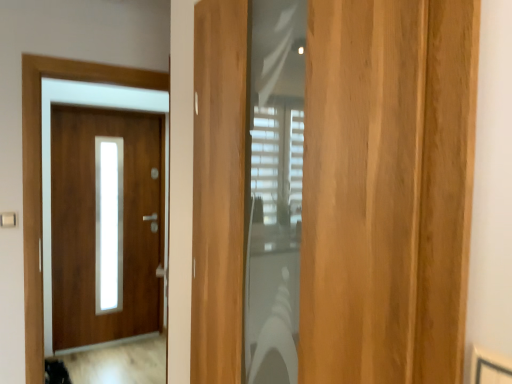
How much space does light brown wood door at center, which is the first door in front-to-back order, occupy vertically?

light brown wood door at center, which is the first door in front-to-back order, is 3.99 feet in height.

What do you see at coordinates (387, 189) in the screenshot? I see `light brown wood door at center, which ranks as the second door in left-to-right order` at bounding box center [387, 189].

Locate an element on the screen. This screenshot has width=512, height=384. light brown wood door at center, which ranks as the second door in left-to-right order is located at coordinates (387, 189).

In order to click on matte wood door at left, marked as the 1th door in a left-to-right arrangement in this screenshot , I will do `click(94, 223)`.

From the picture: What is the approximate width of matte wood door at left, marked as the 1th door in a left-to-right arrangement?

matte wood door at left, marked as the 1th door in a left-to-right arrangement, is 4.40 inches in width.

Describe the element at coordinates (94, 223) in the screenshot. This screenshot has height=384, width=512. I see `matte wood door at left, marked as the 1th door in a left-to-right arrangement` at that location.

Where is `light brown wood door at center, which is the first door in front-to-back order`? light brown wood door at center, which is the first door in front-to-back order is located at coordinates (387, 189).

Between matte wood door at left, acting as the second door starting from the front, and light brown wood door at center, the first door in the right-to-left sequence, which one appears on the right side from the viewer's perspective?

Positioned to the right is light brown wood door at center, the first door in the right-to-left sequence.

Is matte wood door at left, marked as the 1th door in a left-to-right arrangement, in front of light brown wood door at center, which is the first door in front-to-back order?

No.

Is point (148, 330) farther from camera compared to point (301, 250)?

Yes, point (148, 330) is farther from viewer.

From the image's perspective, which one is positioned lower, matte wood door at left, placed as the 1th door when sorted from back to front, or light brown wood door at center, which ranks as the second door in left-to-right order?

matte wood door at left, placed as the 1th door when sorted from back to front.

From a real-world perspective, who is located lower, matte wood door at left, acting as the second door starting from the front, or light brown wood door at center, which is the first door in front-to-back order?

From a 3D spatial view, matte wood door at left, acting as the second door starting from the front, is below.

Considering the relative sizes of matte wood door at left, marked as the 1th door in a left-to-right arrangement, and light brown wood door at center, which ranks as the second door in left-to-right order, in the image provided, is matte wood door at left, marked as the 1th door in a left-to-right arrangement, wider than light brown wood door at center, which ranks as the second door in left-to-right order,?

No, matte wood door at left, marked as the 1th door in a left-to-right arrangement, is not wider than light brown wood door at center, which ranks as the second door in left-to-right order.

Which of these two, matte wood door at left, marked as the 1th door in a left-to-right arrangement, or light brown wood door at center, the 2th door when ordered from back to front, stands shorter?

Standing shorter between the two is light brown wood door at center, the 2th door when ordered from back to front.

Can you confirm if matte wood door at left, acting as the second door starting from the front, is bigger than light brown wood door at center, the first door in the right-to-left sequence?

Yes.

Is matte wood door at left, placed as the 1th door when sorted from back to front, outside of light brown wood door at center, the 2th door when ordered from back to front?

Yes, matte wood door at left, placed as the 1th door when sorted from back to front, is located beyond the bounds of light brown wood door at center, the 2th door when ordered from back to front.

Would you consider matte wood door at left, acting as the second door starting from the front, to be distant from light brown wood door at center, the first door in the right-to-left sequence?

matte wood door at left, acting as the second door starting from the front, is far away from light brown wood door at center, the first door in the right-to-left sequence.

Is matte wood door at left, acting as the second door starting from the front, positioned with its back to light brown wood door at center, the 2th door when ordered from back to front?

No, light brown wood door at center, the 2th door when ordered from back to front, is not at the back of matte wood door at left, acting as the second door starting from the front.

What's the angular difference between matte wood door at left, acting as the second door starting from the front, and light brown wood door at center, the 2th door when ordered from back to front,'s facing directions?

The angle between the facing direction of matte wood door at left, acting as the second door starting from the front, and the facing direction of light brown wood door at center, the 2th door when ordered from back to front, is 90.5 degrees.

You are a GUI agent. You are given a task and a screenshot of the screen. Output one action in this format:
    pyautogui.click(x=<x>, y=<y>)
    Task: Click on the door that appears in front of the matte wood door at left, placed as the 1th door when sorted from back to front
    This screenshot has height=384, width=512.
    Given the screenshot: What is the action you would take?
    pyautogui.click(x=387, y=189)

Based on the photo, is light brown wood door at center, the 2th door when ordered from back to front, to the right of matte wood door at left, acting as the second door starting from the front, from the viewer's perspective?

Yes, light brown wood door at center, the 2th door when ordered from back to front, is to the right of matte wood door at left, acting as the second door starting from the front.

Considering the positions of objects light brown wood door at center, the 2th door when ordered from back to front, and matte wood door at left, which is the second door in right-to-left order, in the image provided, who is in front, light brown wood door at center, the 2th door when ordered from back to front, or matte wood door at left, which is the second door in right-to-left order,?

Positioned in front is light brown wood door at center, the 2th door when ordered from back to front.

Is point (434, 86) more distant than point (70, 274)?

No, (434, 86) is closer to viewer.

From the image's perspective, which one is positioned lower, light brown wood door at center, which is the first door in front-to-back order, or matte wood door at left, acting as the second door starting from the front?

matte wood door at left, acting as the second door starting from the front, from the image's perspective.

From the picture: From a real-world perspective, which object rests below the other?

In real-world perspective, matte wood door at left, placed as the 1th door when sorted from back to front, is lower.

Which object is thinner, light brown wood door at center, the first door in the right-to-left sequence, or matte wood door at left, marked as the 1th door in a left-to-right arrangement?

matte wood door at left, marked as the 1th door in a left-to-right arrangement, is thinner.

Which of these two, light brown wood door at center, which ranks as the second door in left-to-right order, or matte wood door at left, acting as the second door starting from the front, stands shorter?

With less height is light brown wood door at center, which ranks as the second door in left-to-right order.

Can you confirm if light brown wood door at center, which is the first door in front-to-back order, is smaller than matte wood door at left, which is the second door in right-to-left order?

Correct, light brown wood door at center, which is the first door in front-to-back order, occupies less space than matte wood door at left, which is the second door in right-to-left order.

Is light brown wood door at center, the 2th door when ordered from back to front, outside of matte wood door at left, acting as the second door starting from the front?

Yes, light brown wood door at center, the 2th door when ordered from back to front, is located beyond the bounds of matte wood door at left, acting as the second door starting from the front.

Is light brown wood door at center, the 2th door when ordered from back to front, positioned far away from matte wood door at left, which is the second door in right-to-left order?

light brown wood door at center, the 2th door when ordered from back to front, is far away from matte wood door at left, which is the second door in right-to-left order.

Is light brown wood door at center, the first door in the right-to-left sequence, facing away from matte wood door at left, placed as the 1th door when sorted from back to front?

That's not correct — light brown wood door at center, the first door in the right-to-left sequence, is not looking away from matte wood door at left, placed as the 1th door when sorted from back to front.

How different are the orientations of light brown wood door at center, which ranks as the second door in left-to-right order, and matte wood door at left, acting as the second door starting from the front, in degrees?

light brown wood door at center, which ranks as the second door in left-to-right order, and matte wood door at left, acting as the second door starting from the front, are facing 90.5 degrees away from each other.

How distant is light brown wood door at center, which ranks as the second door in left-to-right order, from matte wood door at left, acting as the second door starting from the front?

light brown wood door at center, which ranks as the second door in left-to-right order, is 3.24 meters away from matte wood door at left, acting as the second door starting from the front.

You are a GUI agent. You are given a task and a screenshot of the screen. Output one action in this format:
    pyautogui.click(x=<x>, y=<y>)
    Task: Click on the door above the matte wood door at left, placed as the 1th door when sorted from back to front (from a real-world perspective)
    
    Given the screenshot: What is the action you would take?
    pyautogui.click(x=387, y=189)

Locate an element on the screen. The width and height of the screenshot is (512, 384). door in front of the matte wood door at left, placed as the 1th door when sorted from back to front is located at coordinates (387, 189).

Find the location of `door behind the light brown wood door at center, which ranks as the second door in left-to-right order`. door behind the light brown wood door at center, which ranks as the second door in left-to-right order is located at coordinates pos(94,223).